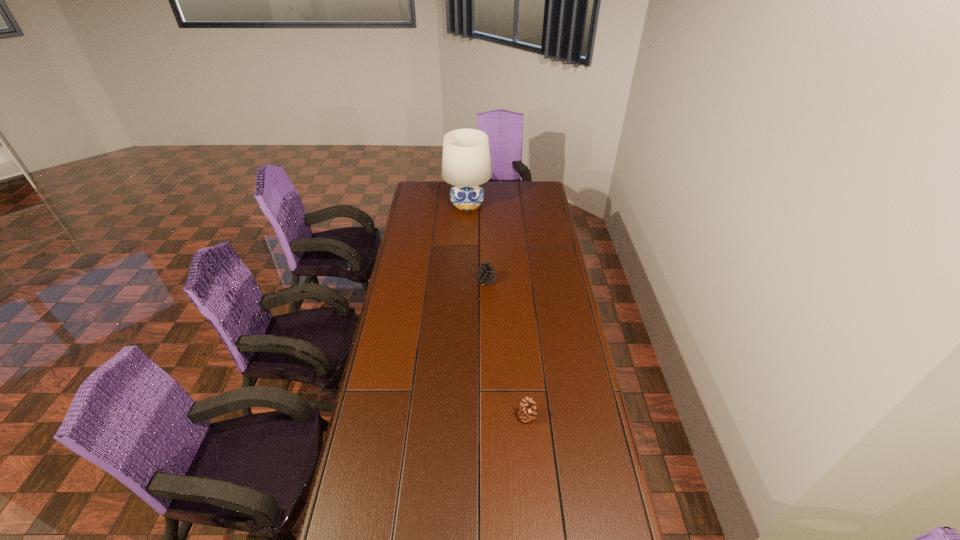
Identify the location of vacant space at the far edge of the desktop. (508, 196).

Identify the location of vacant space at the left edge of the desktop. (408, 363).

You are a GUI agent. You are given a task and a screenshot of the screen. Output one action in this format:
    pyautogui.click(x=<x>, y=<y>)
    Task: Click on the vacant space at the right edge of the desktop
    The width and height of the screenshot is (960, 540).
    Given the screenshot: What is the action you would take?
    pyautogui.click(x=585, y=352)

I want to click on vacant space at the far left corner, so click(x=426, y=188).

I want to click on free location at the far right corner of the desktop, so click(545, 187).

Identify the location of empty location between the lampshade and the nearer pinecone. This screenshot has height=540, width=960. (497, 311).

The width and height of the screenshot is (960, 540). I want to click on free spot between the farthest object and the nearer pinecone, so point(497,311).

This screenshot has width=960, height=540. Find the location of `free spot between the left pinecone and the lampshade`. free spot between the left pinecone and the lampshade is located at coordinates (477, 243).

The height and width of the screenshot is (540, 960). In order to click on free space between the nearest object and the lampshade in this screenshot , I will do `click(497, 311)`.

At what (x,y) coordinates should I click in order to perform the action: click on free spot between the second farthest object and the nearest object. Please return your answer as a coordinate pair (x, y). This screenshot has width=960, height=540. Looking at the image, I should click on (507, 349).